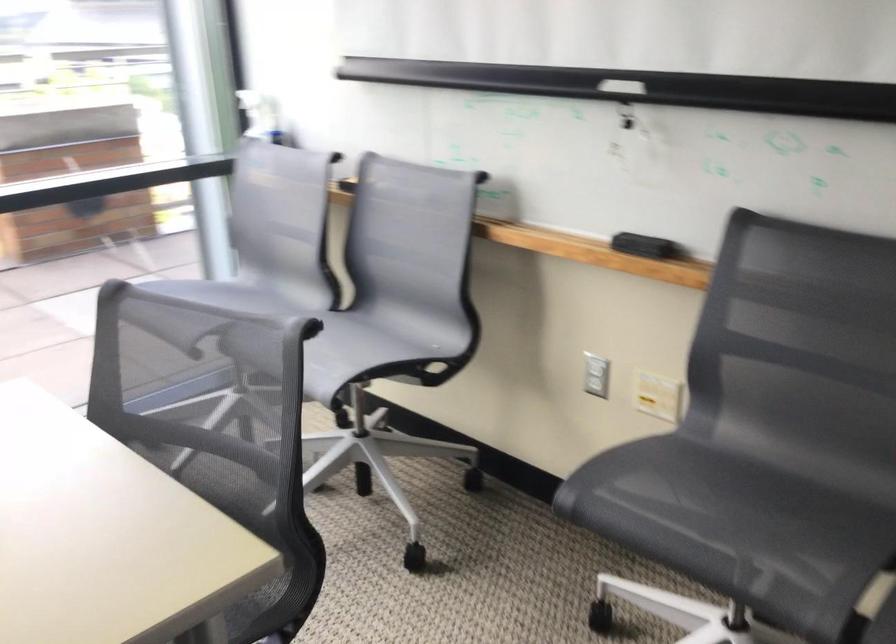
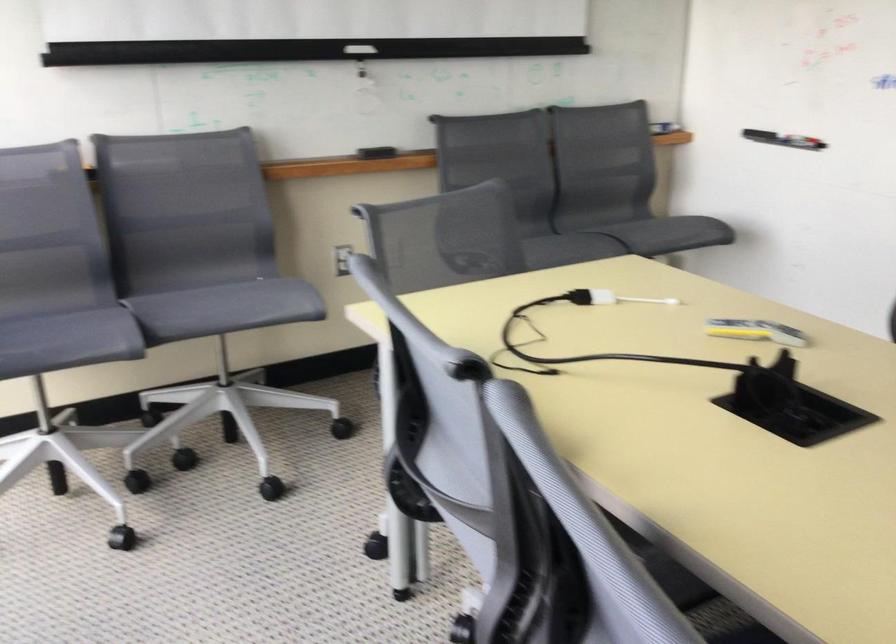
Find the pixel in the second image that matches point 699,513 in the first image.

(538, 247)